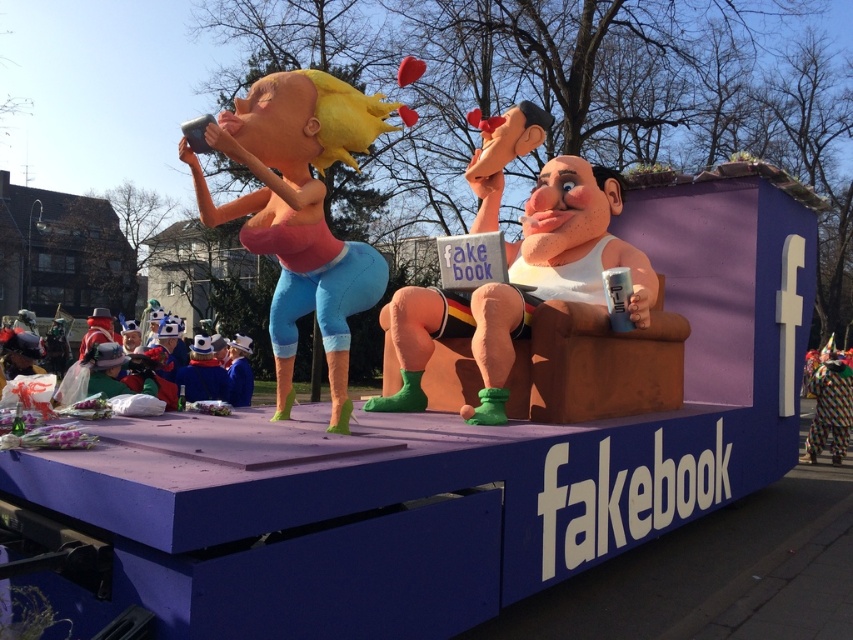
Question: Is smooth plastic figure at center above multicolored fabric clown at lower right?

Choices:
 (A) no
 (B) yes

Answer: (B)

Question: Which point is closer to the camera?

Choices:
 (A) (816, 369)
 (B) (242, 156)

Answer: (B)

Question: Which object is closer to the camera taking this photo?

Choices:
 (A) matte orange figure at left
 (B) multicolored fabric clown at lower right

Answer: (A)

Question: Which point appears farthest from the camera in this image?

Choices:
 (A) (525, 317)
 (B) (830, 388)

Answer: (B)

Question: Can you confirm if matte orange figure at left is thinner than multicolored fabric clown at lower right?

Choices:
 (A) yes
 (B) no

Answer: (A)

Question: Can you confirm if matte orange figure at left is positioned above multicolored fabric clown at lower right?

Choices:
 (A) no
 (B) yes

Answer: (B)